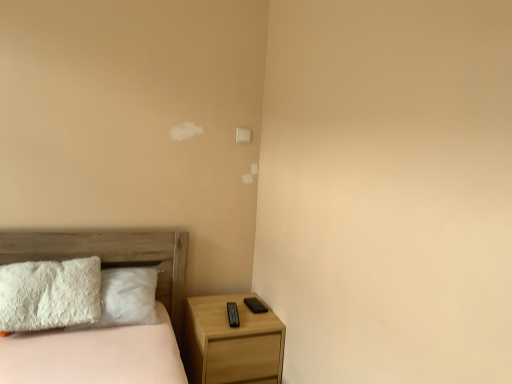
Question: Is light wood/texture nightstand at lower right at the right side of wooden bed at lower left?

Choices:
 (A) no
 (B) yes

Answer: (B)

Question: Is light wood/texture nightstand at lower right turned away from wooden bed at lower left?

Choices:
 (A) yes
 (B) no

Answer: (B)

Question: From a real-world perspective, is light wood/texture nightstand at lower right below wooden bed at lower left?

Choices:
 (A) no
 (B) yes

Answer: (B)

Question: Considering the relative sizes of light wood/texture nightstand at lower right and wooden bed at lower left in the image provided, is light wood/texture nightstand at lower right smaller than wooden bed at lower left?

Choices:
 (A) yes
 (B) no

Answer: (A)

Question: Is light wood/texture nightstand at lower right closer to the viewer compared to wooden bed at lower left?

Choices:
 (A) yes
 (B) no

Answer: (B)

Question: Is light wood/texture nightstand at lower right to the left of wooden bed at lower left from the viewer's perspective?

Choices:
 (A) yes
 (B) no

Answer: (B)

Question: Can you confirm if wooden bed at lower left is thinner than light wood/texture nightstand at lower right?

Choices:
 (A) yes
 (B) no

Answer: (B)

Question: From the image's perspective, is wooden bed at lower left under light wood/texture nightstand at lower right?

Choices:
 (A) no
 (B) yes

Answer: (A)

Question: From a real-world perspective, is wooden bed at lower left located higher than light wood/texture nightstand at lower right?

Choices:
 (A) yes
 (B) no

Answer: (A)

Question: Considering the relative sizes of wooden bed at lower left and light wood/texture nightstand at lower right in the image provided, is wooden bed at lower left wider than light wood/texture nightstand at lower right?

Choices:
 (A) yes
 (B) no

Answer: (A)

Question: Could you tell me if wooden bed at lower left is turned towards light wood/texture nightstand at lower right?

Choices:
 (A) yes
 (B) no

Answer: (B)

Question: Does wooden bed at lower left lie behind light wood/texture nightstand at lower right?

Choices:
 (A) yes
 (B) no

Answer: (B)

Question: Is wooden bed at lower left inside the boundaries of light wood/texture nightstand at lower right, or outside?

Choices:
 (A) inside
 (B) outside

Answer: (B)